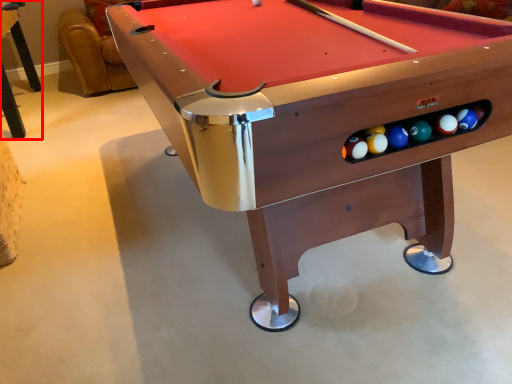
Question: Observing the image, what is the correct spatial positioning of table (annotated by the red box) in reference to billiard table?

Choices:
 (A) right
 (B) left

Answer: (B)